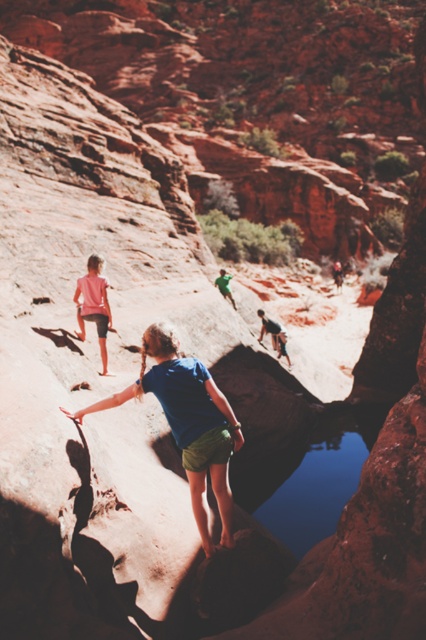
Between blue fabric shorts at center and pink fabric shorts at lower left, which one appears on the left side from the viewer's perspective?

pink fabric shorts at lower left is more to the left.

Find the location of a particular element. The width and height of the screenshot is (426, 640). blue fabric shorts at center is located at coordinates (187, 422).

Between pink fabric shorts at lower left and smooth gray rock climber at center, which one has less height?

Standing shorter between the two is smooth gray rock climber at center.

Is pink fabric shorts at lower left to the right of smooth gray rock climber at center from the viewer's perspective?

In fact, pink fabric shorts at lower left is to the left of smooth gray rock climber at center.

Does point (83, 317) lie in front of point (275, 337)?

Yes, point (83, 317) is in front of point (275, 337).

This screenshot has width=426, height=640. In order to click on pink fabric shorts at lower left in this screenshot , I will do `click(94, 305)`.

Between blue fabric shorts at center and smooth gray rock climber at center, which one is positioned lower?

Positioned lower is blue fabric shorts at center.

Does blue fabric shorts at center have a larger size compared to smooth gray rock climber at center?

Correct, blue fabric shorts at center is larger in size than smooth gray rock climber at center.

In the scene shown: Who is more distant from viewer, [152,387] or [287,362]?

Positioned behind is point [287,362].

What are the coordinates of `blue fabric shorts at center` in the screenshot? It's located at (187, 422).